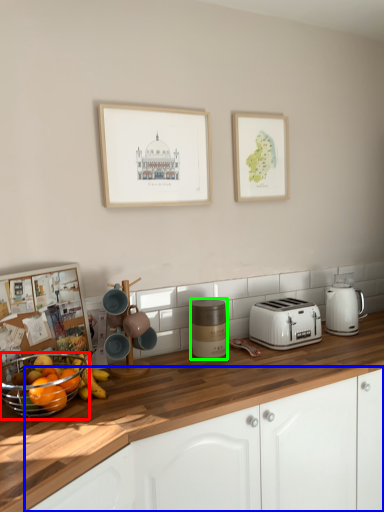
Question: Which object is the closest to the basket (highlighted by a red box)? Choose among these: cabinetry (highlighted by a blue box) or appliance (highlighted by a green box).

Choices:
 (A) cabinetry
 (B) appliance

Answer: (A)